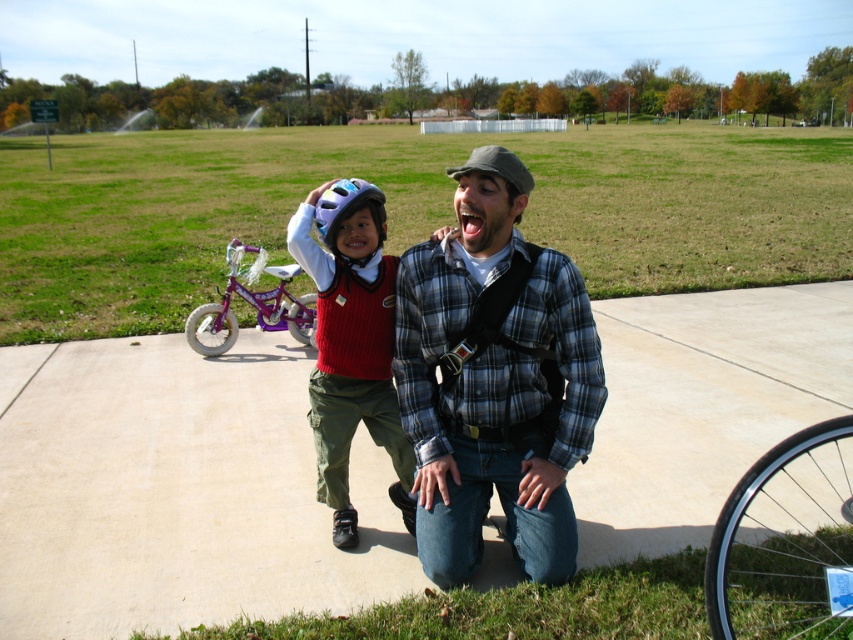
You are a delivery person who needs to place a heavy box on the ground. You see the concrete at center and the black rubber tire at lower right. Which surface would be more stable for placing the box?

The concrete at center is positioned under the black rubber tire at lower right, so the concrete at center is more stable because it is a solid surface supporting the tire, making it suitable for placing the heavy box.